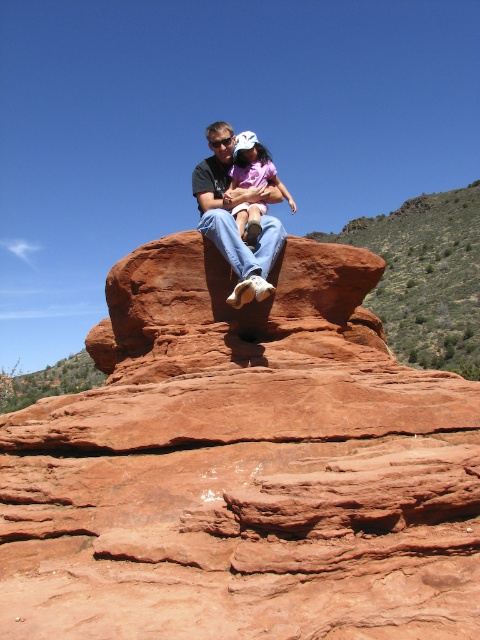
Question: Is reddish-brown sandstone at upper center further to camera compared to matte pink shirt at center?

Choices:
 (A) yes
 (B) no

Answer: (B)

Question: Which point is farther to the camera?

Choices:
 (A) (301, 460)
 (B) (263, 240)
 (C) (248, 230)

Answer: (B)

Question: Is reddish-brown sandstone at upper center smaller than matte black shirt at center?

Choices:
 (A) no
 (B) yes

Answer: (A)

Question: Does reddish-brown sandstone at upper center have a greater width compared to matte black shirt at center?

Choices:
 (A) yes
 (B) no

Answer: (A)

Question: Among these points, which one is farthest from the camera?

Choices:
 (A) (262, 148)
 (B) (250, 256)

Answer: (A)

Question: Which point is closer to the camera taking this photo?

Choices:
 (A) (216, 189)
 (B) (444, 625)

Answer: (B)